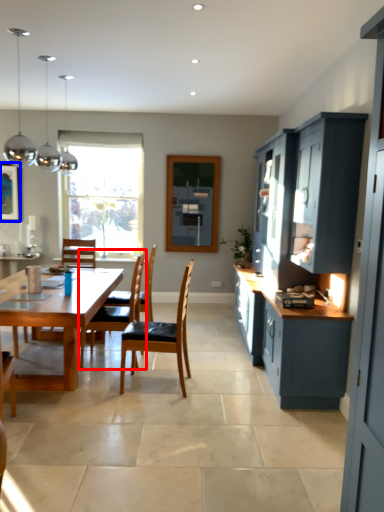
Question: Which of the following is the closest to the observer, chair (highlighted by a red box) or picture frame (highlighted by a blue box)?

Choices:
 (A) chair
 (B) picture frame

Answer: (A)